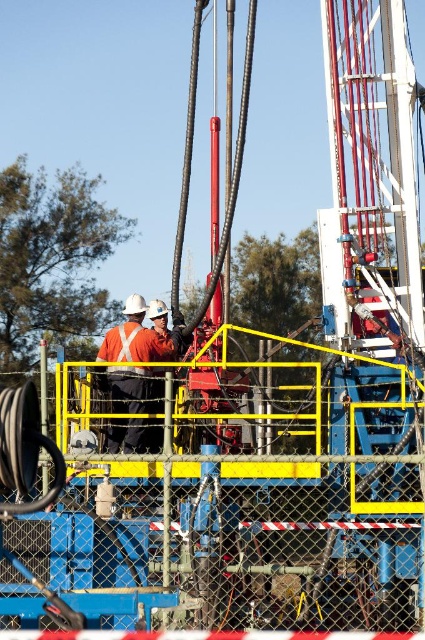
Can you confirm if orange reflective vest at center is taller than orange reflective safety vest at center?

Yes, orange reflective vest at center is taller than orange reflective safety vest at center.

Is orange reflective vest at center bigger than orange reflective safety vest at center?

Yes.

Is point (176, 349) behind point (130, 346)?

That is True.

Locate an element on the screen. orange reflective vest at center is located at coordinates (138, 337).